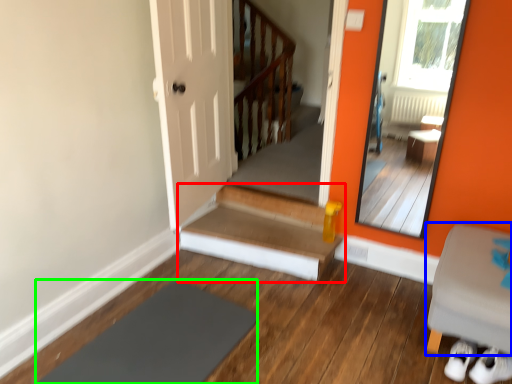
Question: Which object is positioned farthest from stairs (highlighted by a red box)? Select from furniture (highlighted by a blue box) and slate (highlighted by a green box).

Choices:
 (A) furniture
 (B) slate

Answer: (A)